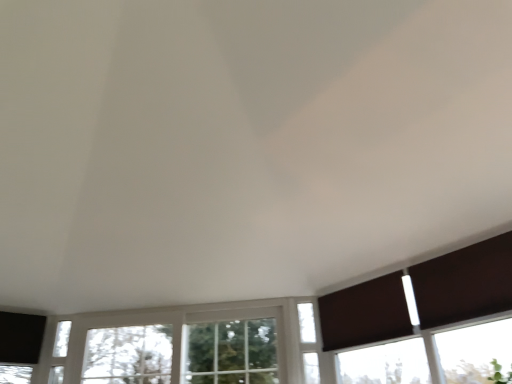
Question: In terms of width, does clear glass window at center, positioned as the second window in right-to-left order, look wider or thinner when compared to brown fabric curtain at lower right?

Choices:
 (A) wide
 (B) thin

Answer: (A)

Question: In terms of height, does clear glass window at center, positioned as the second window in right-to-left order, look taller or shorter compared to brown fabric curtain at lower right?

Choices:
 (A) tall
 (B) short

Answer: (A)

Question: Which object is positioned farthest from the brown matte shutter at right?

Choices:
 (A) clear glass window at center, marked as the second window in a left-to-right arrangement
 (B) brown fabric curtain at lower right
 (C) white glass window at lower left, which is the 1th window in left-to-right order
 (D) white glass window at center, which is the 3th window in left-to-right order

Answer: (C)

Question: Based on their relative distances, which object is nearer to the white glass window at lower left, which is the 1th window in left-to-right order?

Choices:
 (A) brown fabric curtain at lower right
 (B) white glass window at center, which is the 3th window in left-to-right order
 (C) brown matte shutter at right
 (D) clear glass window at center, positioned as the second window in right-to-left order

Answer: (D)